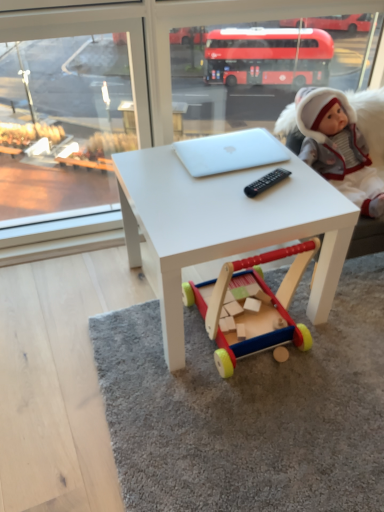
Question: Looking at their shapes, would you say wooden toy at center is wider or thinner than white matte laptop at center?

Choices:
 (A) wide
 (B) thin

Answer: (A)

Question: From a real-world perspective, relative to white matte laptop at center, is wooden toy at center vertically above or below?

Choices:
 (A) below
 (B) above

Answer: (A)

Question: Based on their relative distances, which object is nearer to the white plush doll at upper right?

Choices:
 (A) wooden toy at center
 (B) white matte table at center
 (C) white matte laptop at center

Answer: (C)

Question: Which is farther from the white matte laptop at center?

Choices:
 (A) white matte table at center
 (B) wooden toy at center
 (C) white plush doll at upper right

Answer: (B)